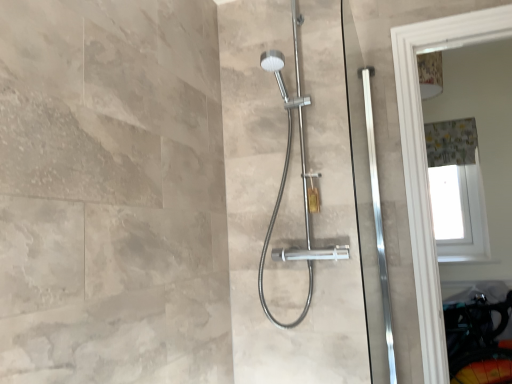
What do you see at coordinates (451, 142) in the screenshot? I see `gray fabric shower curtain at upper right` at bounding box center [451, 142].

This screenshot has height=384, width=512. Find the location of `gray fabric shower curtain at upper right`. gray fabric shower curtain at upper right is located at coordinates (451, 142).

Image resolution: width=512 pixels, height=384 pixels. What do you see at coordinates (278, 188) in the screenshot?
I see `satin nickel shower head at center` at bounding box center [278, 188].

Measure the distance between point (x=297, y=212) and camera.

Point (x=297, y=212) is 5.71 feet from camera.

The width and height of the screenshot is (512, 384). What are the coordinates of `satin nickel shower head at center` in the screenshot? It's located at (278, 188).

You are a GUI agent. You are given a task and a screenshot of the screen. Output one action in this format:
    pyautogui.click(x=<x>, y=<y>)
    Task: Click on the gray fabric shower curtain at upper right
    
    Given the screenshot: What is the action you would take?
    point(451,142)

Is gray fabric shower curtain at upper right at the right side of satin nickel shower head at center?

Yes.

Between gray fabric shower curtain at upper right and satin nickel shower head at center, which one is positioned behind?

gray fabric shower curtain at upper right is further away from the camera.

Does point (452, 145) lie in front of point (285, 131)?

No, it is not.

From the image's perspective, which one is positioned lower, gray fabric shower curtain at upper right or satin nickel shower head at center?

satin nickel shower head at center is shown below in the image.

From a real-world perspective, is gray fabric shower curtain at upper right positioned over satin nickel shower head at center based on gravity?

Yes, from a real-world perspective, gray fabric shower curtain at upper right is on top of satin nickel shower head at center.

In terms of width, does gray fabric shower curtain at upper right look wider or thinner when compared to satin nickel shower head at center?

In the image, gray fabric shower curtain at upper right appears to be more narrow than satin nickel shower head at center.

Is gray fabric shower curtain at upper right taller than satin nickel shower head at center?

In fact, gray fabric shower curtain at upper right may be shorter than satin nickel shower head at center.

Looking at the image, does gray fabric shower curtain at upper right seem bigger or smaller compared to satin nickel shower head at center?

Clearly, gray fabric shower curtain at upper right is smaller in size than satin nickel shower head at center.

Looking at this image, is gray fabric shower curtain at upper right inside the boundaries of satin nickel shower head at center, or outside?

gray fabric shower curtain at upper right is outside satin nickel shower head at center.

Is gray fabric shower curtain at upper right positioned far away from satin nickel shower head at center?

Yes, gray fabric shower curtain at upper right is far from satin nickel shower head at center.

Is gray fabric shower curtain at upper right positioned with its back to satin nickel shower head at center?

No, gray fabric shower curtain at upper right is not facing the opposite direction of satin nickel shower head at center.

What's the angular difference between gray fabric shower curtain at upper right and satin nickel shower head at center's facing directions?

0.827 degrees separate the facing orientations of gray fabric shower curtain at upper right and satin nickel shower head at center.

Image resolution: width=512 pixels, height=384 pixels. In the image, there is a gray fabric shower curtain at upper right. In order to click on screen door below it (from a real-world perspective) in this screenshot , I will do `click(278, 188)`.

Can you confirm if satin nickel shower head at center is positioned to the right of gray fabric shower curtain at upper right?

No.

From the picture: Is satin nickel shower head at center positioned behind gray fabric shower curtain at upper right?

No, satin nickel shower head at center is in front of gray fabric shower curtain at upper right.

Which point is more distant from viewer, (343, 179) or (428, 165)?

The point (428, 165) is farther from the camera.

From the image's perspective, which object appears higher, satin nickel shower head at center or gray fabric shower curtain at upper right?

gray fabric shower curtain at upper right.

From a real-world perspective, which is physically above, satin nickel shower head at center or gray fabric shower curtain at upper right?

gray fabric shower curtain at upper right, from a real-world perspective.

Considering the relative sizes of satin nickel shower head at center and gray fabric shower curtain at upper right in the image provided, is satin nickel shower head at center wider than gray fabric shower curtain at upper right?

Yes, satin nickel shower head at center is wider than gray fabric shower curtain at upper right.

Between satin nickel shower head at center and gray fabric shower curtain at upper right, which one has more height?

Standing taller between the two is satin nickel shower head at center.

Considering the sizes of objects satin nickel shower head at center and gray fabric shower curtain at upper right in the image provided, who is smaller, satin nickel shower head at center or gray fabric shower curtain at upper right?

With smaller size is gray fabric shower curtain at upper right.

Choose the correct answer: Is satin nickel shower head at center inside gray fabric shower curtain at upper right or outside it?

satin nickel shower head at center is not inside gray fabric shower curtain at upper right, it's outside.

Does satin nickel shower head at center touch gray fabric shower curtain at upper right?

satin nickel shower head at center and gray fabric shower curtain at upper right are clearly separated.

Does satin nickel shower head at center turn towards gray fabric shower curtain at upper right?

No, satin nickel shower head at center is not facing towards gray fabric shower curtain at upper right.

Can you tell me how much satin nickel shower head at center and gray fabric shower curtain at upper right differ in facing direction?

The angle between the facing direction of satin nickel shower head at center and the facing direction of gray fabric shower curtain at upper right is 0.827 degrees.

Could you measure the distance between satin nickel shower head at center and gray fabric shower curtain at upper right?

satin nickel shower head at center and gray fabric shower curtain at upper right are 4.57 feet apart.

Locate an element on the screen. shower curtain that is behind the satin nickel shower head at center is located at coordinates 451,142.

You are a GUI agent. You are given a task and a screenshot of the screen. Output one action in this format:
    pyautogui.click(x=<x>, y=<y>)
    Task: Click on the screen door in front of the gray fabric shower curtain at upper right
    The height and width of the screenshot is (384, 512).
    Given the screenshot: What is the action you would take?
    pyautogui.click(x=278, y=188)

At what (x,y) coordinates should I click in order to perform the action: click on shower curtain above the satin nickel shower head at center (from a real-world perspective). Please return your answer as a coordinate pair (x, y). This screenshot has width=512, height=384. Looking at the image, I should click on (451, 142).